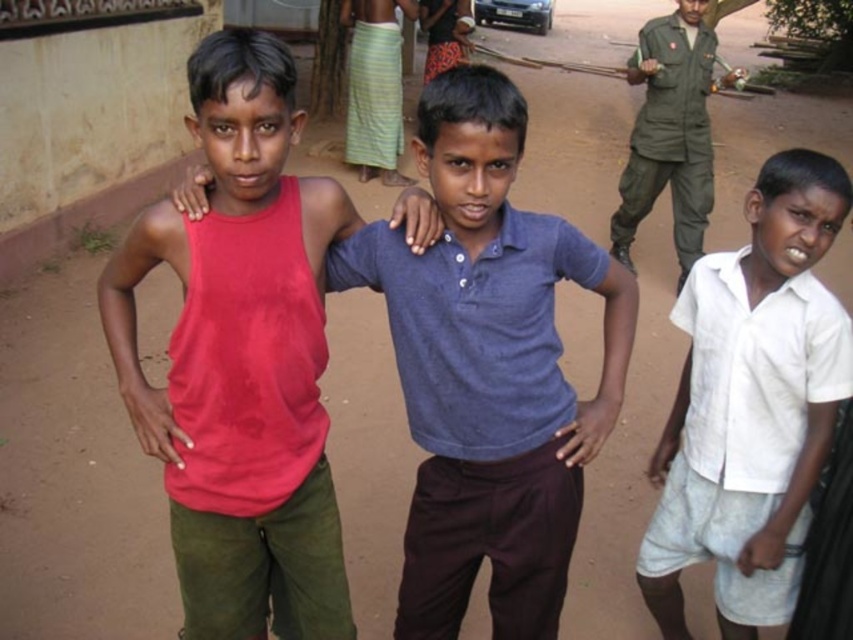
Question: Is matte red tank top at center smaller than blue cotton shirt at center?

Choices:
 (A) yes
 (B) no

Answer: (B)

Question: Is blue cotton shirt at center closer to camera compared to green uniform at upper right?

Choices:
 (A) yes
 (B) no

Answer: (A)

Question: Does matte red tank top at center appear under blue cotton shirt at center?

Choices:
 (A) yes
 (B) no

Answer: (A)

Question: Which point is closer to the camera?

Choices:
 (A) (433, 440)
 (B) (303, 284)
 (C) (630, 163)

Answer: (B)

Question: Which object is positioned closest to the white cotton shirt at right?

Choices:
 (A) matte red tank top at center
 (B) green uniform at upper right
 (C) blue cotton shirt at center

Answer: (C)

Question: Which point is farther to the camera?

Choices:
 (A) green uniform at upper right
 (B) matte red tank top at center
 (C) blue cotton shirt at center
 (D) white cotton shirt at right

Answer: (A)